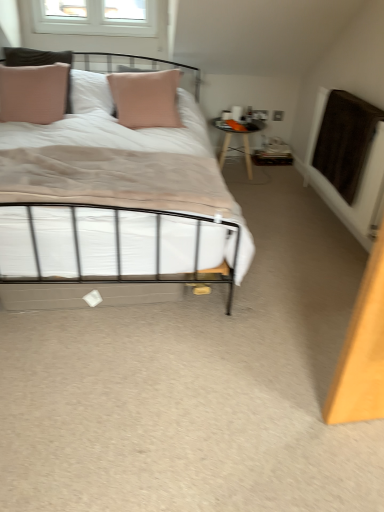
What is the approximate height of wooden table at right?

16.66 inches.

This screenshot has height=512, width=384. I want to click on wooden table at right, so click(238, 133).

Describe the element at coordinates (238, 133) in the screenshot. I see `wooden table at right` at that location.

At what (x,y) coordinates should I click in order to perform the action: click on wooden table at right. Please return your answer as a coordinate pair (x, y). This screenshot has width=384, height=512. Looking at the image, I should click on (238, 133).